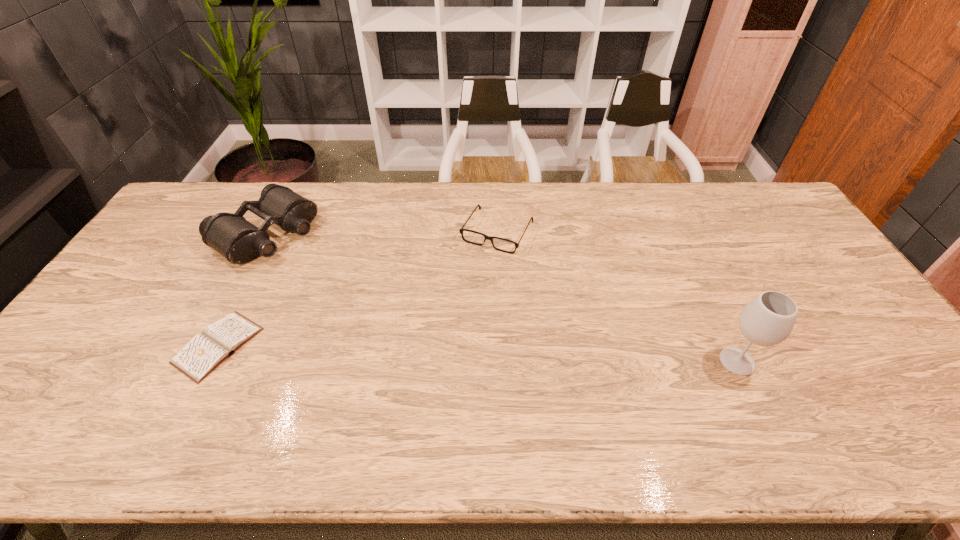
This screenshot has height=540, width=960. I want to click on vacant region at the left edge, so click(x=111, y=300).

You are a GUI agent. You are given a task and a screenshot of the screen. Output one action in this format:
    pyautogui.click(x=<x>, y=<y>)
    Task: Click on the free location at the right edge
    This screenshot has height=540, width=960.
    Given the screenshot: What is the action you would take?
    pyautogui.click(x=804, y=296)

Identify the location of free region at the near left corner of the desktop. (73, 399).

Locate an element on the screen. This screenshot has height=540, width=960. vacant region at the far right corner of the desktop is located at coordinates [x=755, y=213].

This screenshot has height=540, width=960. I want to click on vacant region between the shortest object and the second shortest object, so click(358, 288).

This screenshot has height=540, width=960. I want to click on vacant area between the wineglass and the second tallest object, so click(x=501, y=297).

Where is `vacant space that's between the wineglass and the spectacles`? The height and width of the screenshot is (540, 960). vacant space that's between the wineglass and the spectacles is located at coordinates (617, 296).

The width and height of the screenshot is (960, 540). Identify the location of empty space between the binoculars and the second object from right to left. (381, 232).

At what (x,y) coordinates should I click in order to perform the action: click on vacant area that lies between the spectacles and the binoculars. Please return your answer as a coordinate pair (x, y). The height and width of the screenshot is (540, 960). Looking at the image, I should click on (381, 232).

This screenshot has height=540, width=960. Identify the location of free space between the diary and the tallest object. (477, 354).